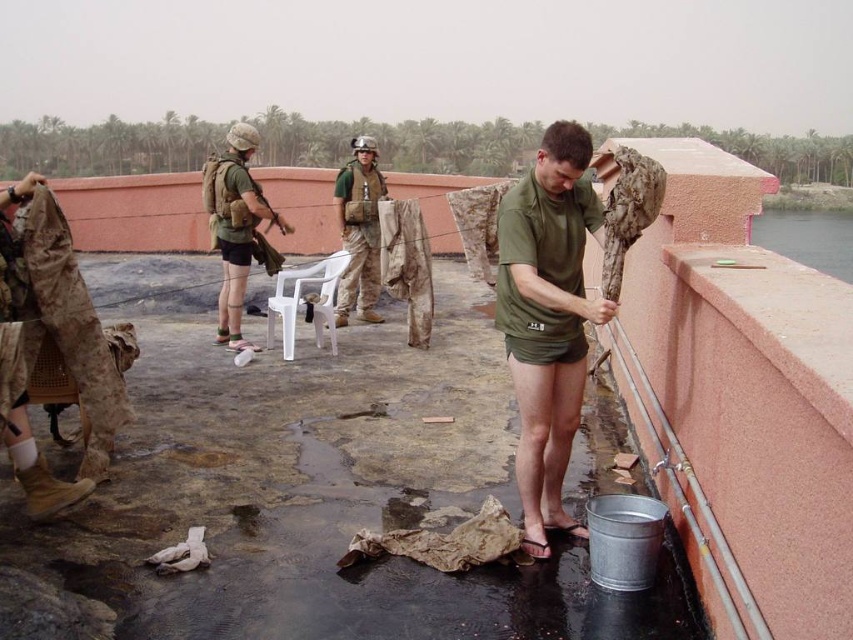
Between camouflage fabric vest at center and camouflage fabric uniform at center, which one has more height?

camouflage fabric uniform at center

Is point (257, 141) farther from camera compared to point (355, 205)?

No, it is in front of (355, 205).

Where is `camouflage fabric vest at center`? The height and width of the screenshot is (640, 853). camouflage fabric vest at center is located at coordinates (236, 227).

Which is in front, point (561, 476) or point (496, 308)?

Point (496, 308)

Which is behind, point (556, 244) or point (524, 330)?

Point (524, 330)

Is point (556, 301) behind point (503, 212)?

No.

At what (x,y) coordinates should I click in order to perform the action: click on green matte shirt at center. Please return your answer as a coordinate pair (x, y). Looking at the image, I should click on (547, 317).

Is green matte t-shirt at center taller than camouflage fabric vest at upper center?

No.

What do you see at coordinates (543, 266) in the screenshot?
I see `green matte t-shirt at center` at bounding box center [543, 266].

Where is `green matte t-shirt at center`? The width and height of the screenshot is (853, 640). green matte t-shirt at center is located at coordinates (543, 266).